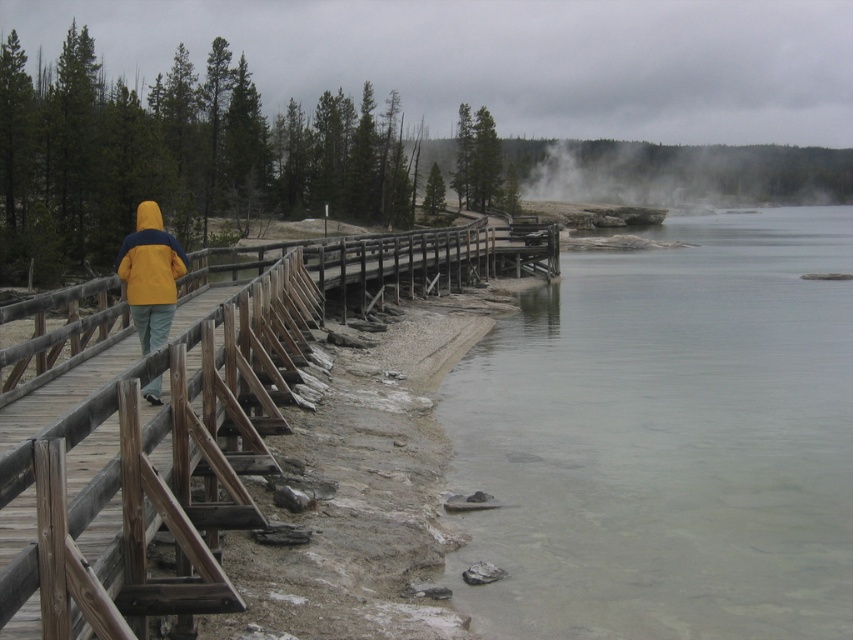
Who is positioned more to the left, wooden rail at center or yellow matte jacket at center?

yellow matte jacket at center is more to the left.

Does wooden rail at center lie in front of yellow matte jacket at center?

Yes.

This screenshot has height=640, width=853. What are the coordinates of `wooden rail at center` in the screenshot? It's located at (207, 433).

Locate an element on the screen. wooden rail at center is located at coordinates (207, 433).

Does clear water at lower right have a lesser height compared to yellow matte jacket at center?

No, clear water at lower right is not shorter than yellow matte jacket at center.

Which is more to the left, clear water at lower right or yellow matte jacket at center?

Positioned to the left is yellow matte jacket at center.

Is point (827, 532) behind point (164, 257)?

Yes, point (827, 532) is behind point (164, 257).

You are a GUI agent. You are given a task and a screenshot of the screen. Output one action in this format:
    pyautogui.click(x=<x>, y=<y>)
    Task: Click on the clear water at lower right
    
    Given the screenshot: What is the action you would take?
    pyautogui.click(x=666, y=438)

Does clear water at lower right have a lesser width compared to wooden rail at center?

Incorrect, clear water at lower right's width is not less than wooden rail at center's.

Does clear water at lower right appear under wooden rail at center?

Yes, clear water at lower right is below wooden rail at center.

Measure the distance between clear water at lower right and camera.

clear water at lower right is 8.30 meters away from camera.

I want to click on clear water at lower right, so click(666, 438).